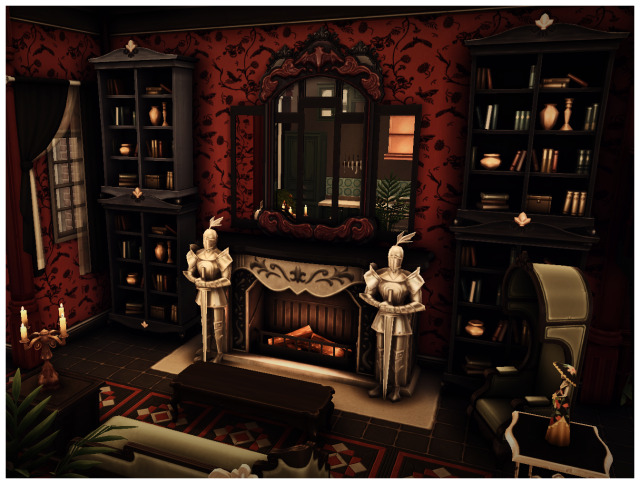
The image size is (640, 484). Identify the location of mirror. (314, 147).